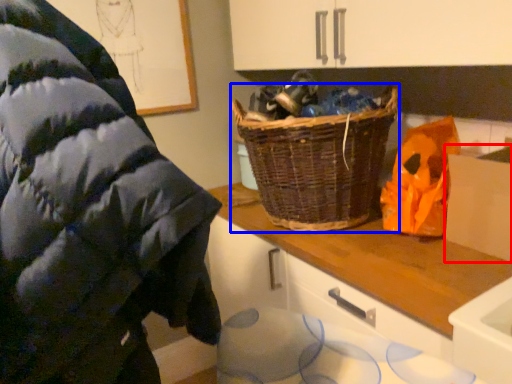
Question: Which object is further to the camera taking this photo, cardboard box (highlighted by a red box) or picnic basket (highlighted by a blue box)?

Choices:
 (A) cardboard box
 (B) picnic basket

Answer: (B)